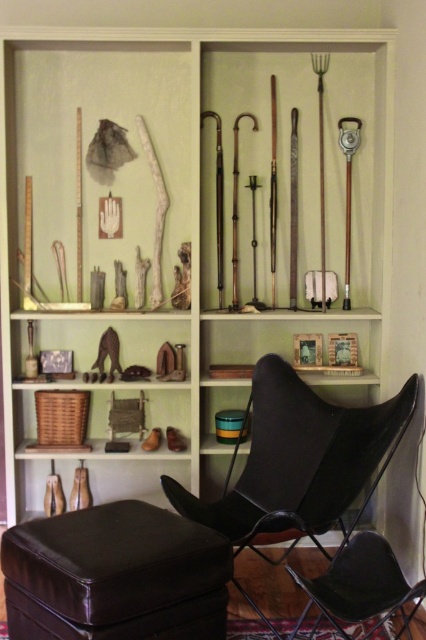
You are a delivery person who needs to place a new item on the shelf. The item is taller than the black leather chair at lower right but shorter than the wooden tools at upper center. Where can you place it?

The item can be placed on the upper section of the shelving unit because the wooden tools at upper center are taller than the black leather chair at lower right, and the item is shorter than the wooden tools at upper center.

You are standing in front of the shelving unit and want to reach the point marked at coordinates (354, 570). If your arm can extend 1.5 meters, can you comfortably reach that point without moving closer?

The distance between you and the point marked at coordinates (354, 570) is 2.34 meters. Since your arm can only extend 1.5 meters, you cannot comfortably reach that point without moving closer.

You are standing in front of the shelving unit and want to pick up the black matte chair at center and the wooden figurines at center. Which object is easier to reach without moving your position?

The black matte chair at center is closer to the viewer than the wooden figurines at center, so it is easier to reach without moving your position.